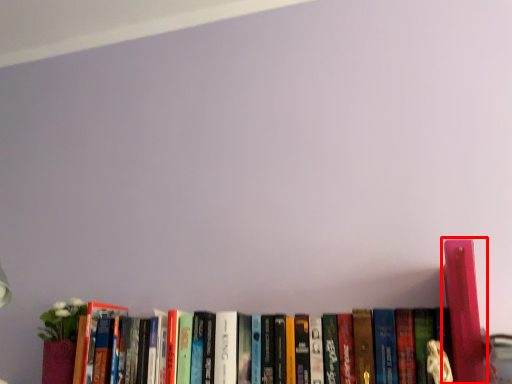
Question: From the image's perspective, where is book (annotated by the red box) located in relation to book in the image?

Choices:
 (A) above
 (B) below

Answer: (A)